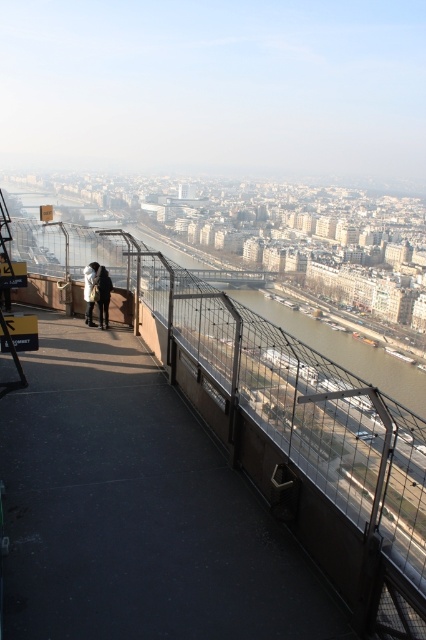
You are an observer standing on the walkway and see both the black leather jacket at upper left and the dark gray jacket at center. Which jacket takes up more area in the image?

The dark gray jacket at center takes up more area in the image because it occupies more space than the black leather jacket at upper left.

You are standing on the black rubber path at center and want to place a small backpack on the black leather jacket at upper left. Is the backpack within your reach without moving from the path?

The black rubber path at center is below the black leather jacket at upper left, so you can reach the black leather jacket at upper left from the path.

You are standing on the walkway and want to place your black leather jacket at upper left on the black rubber path at center. Is the path accessible from your current position?

The black rubber path at center is in front of the black leather jacket at upper left, so yes, the path is accessible from your current position.